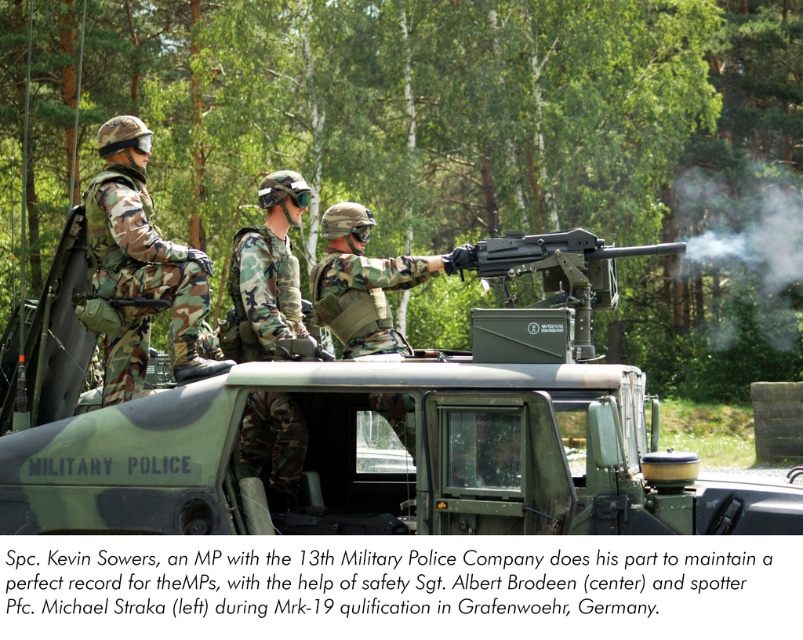
You are a drone operator controlling a drone that needs to capture a closeup shot of the point at coordinates (47,445). The drone can only move within a 20 feet radius from its current position. Is the point within the drone operator s operational range?

The point at coordinates (47,445) is 23.25 feet away from the camera, which is beyond the drone operator s 20 feet operational range. Therefore, the drone cannot reach the point.

You are a photographer planning to take a wide shot of the military training scene. You need to ensure both the green matte military vehicle at center and the camo fabric helmet at center are fully visible in the frame. Considering their sizes, which object might require you to adjust your camera angle to include it properly?

The green matte military vehicle at center is larger in width than the camo fabric helmet at center, so you might need to adjust your camera angle to ensure the entire vehicle fits into the frame while also capturing the helmet.